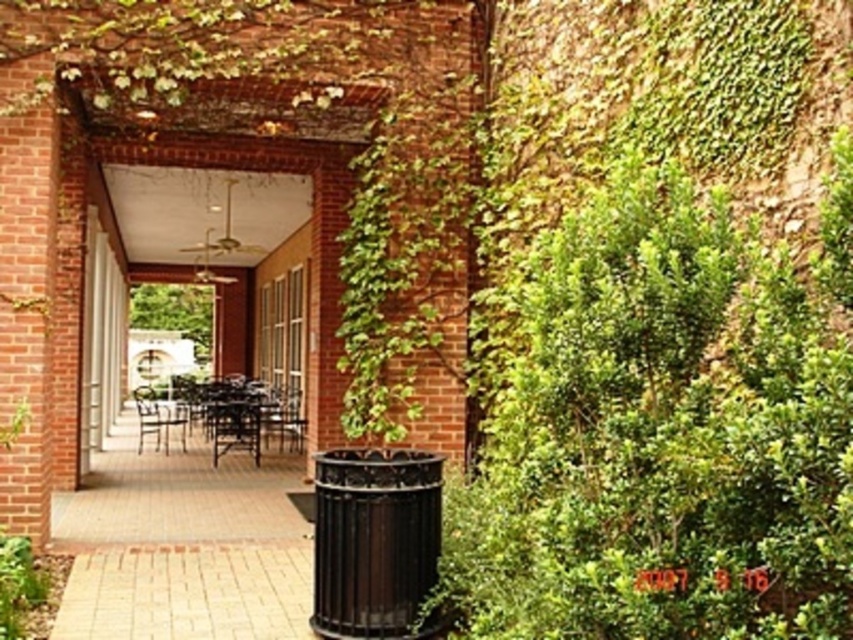
Is point (292, 392) closer to camera compared to point (175, 420)?

No.

Who is more forward, (260, 413) or (170, 424)?

Positioned in front is point (260, 413).

This screenshot has height=640, width=853. I want to click on metallic black chair at center, so pos(283,417).

Is wooden chair at center above metallic black chair at center?

Incorrect, wooden chair at center is not positioned above metallic black chair at center.

Who is more distant from viewer, [245,449] or [288,396]?

The point [288,396] is behind.

The height and width of the screenshot is (640, 853). What are the coordinates of `wooden chair at center` in the screenshot? It's located at (234, 428).

Between wooden chair at center and metallic brown chair at center, which one has more height?

wooden chair at center is taller.

Is wooden chair at center wider than metallic brown chair at center?

No, wooden chair at center is not wider than metallic brown chair at center.

Who is more forward, (245,410) or (140,444)?

Point (140,444) is more forward.

Where is `wooden chair at center`? The width and height of the screenshot is (853, 640). wooden chair at center is located at coordinates click(234, 428).